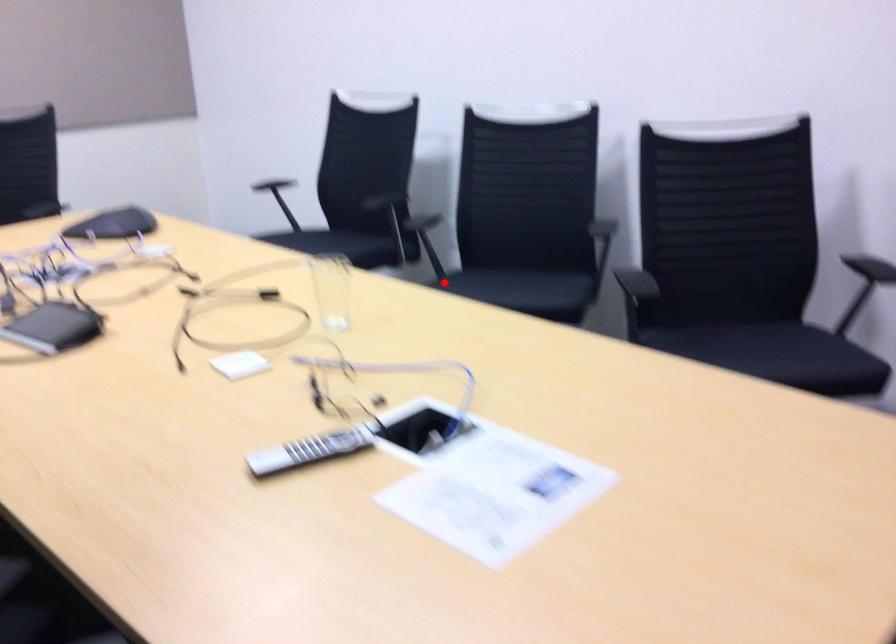
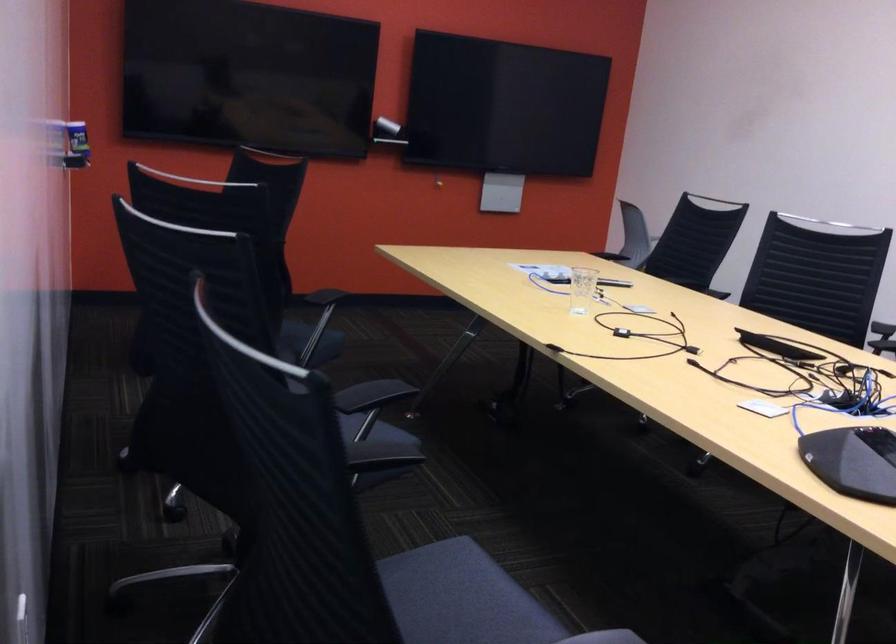
Question: I am providing you with two images of the same scene from different viewpoints. Given a red point in image1, look at the same physical point in image2. Is it:

Choices:
 (A) Closer to the viewpoint
 (B) Farther from the viewpoint

Answer: (A)